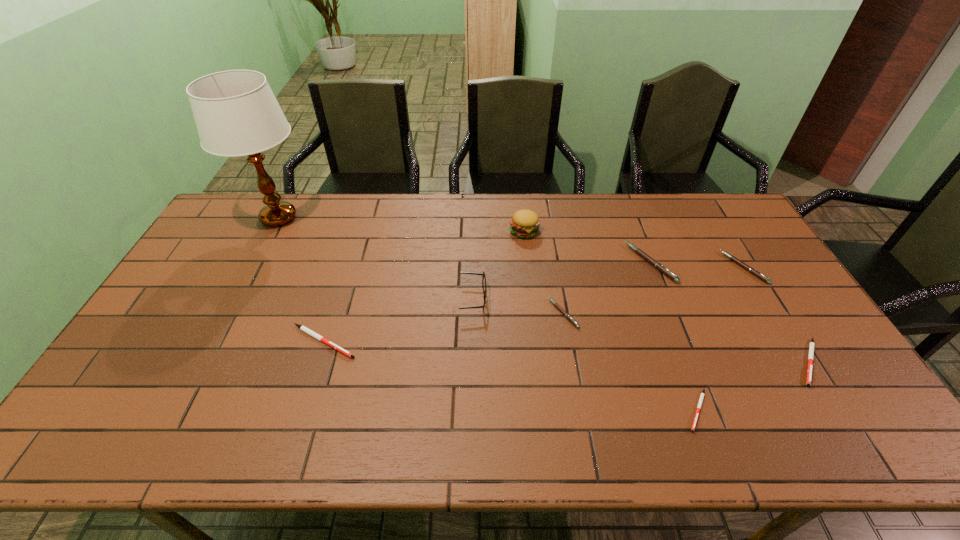
The width and height of the screenshot is (960, 540). Find the location of `object that can be found as the eighth closest to the brown table lamp`. object that can be found as the eighth closest to the brown table lamp is located at coordinates (811, 348).

Select which object is the third closest to the shortest pen. Please provide its 2D coordinates. Your answer should be formatted as a tuple, i.e. [(x, y)], where the tuple contains the x and y coordinates of a point satisfying the conditions above.

[(657, 265)]

Locate an element on the screen. This screenshot has height=540, width=960. pen that is the second nearest to the second biggest pink pen is located at coordinates (811, 348).

This screenshot has width=960, height=540. I want to click on pen that is the closest one to the second biggest pink pen, so click(x=657, y=265).

Point out which pink pen is positioned as the second nearest to the nearest pen. Please provide its 2D coordinates. Your answer should be formatted as a tuple, i.e. [(x, y)], where the tuple contains the x and y coordinates of a point satisfying the conditions above.

[(657, 265)]

Image resolution: width=960 pixels, height=540 pixels. I want to click on pink pen that is the closest one to the leftmost pen, so click(x=556, y=305).

Identify the location of the closest white pen to the spectacles. This screenshot has height=540, width=960. (303, 328).

This screenshot has height=540, width=960. Find the location of `white pen that is the second closest to the brown table lamp`. white pen that is the second closest to the brown table lamp is located at coordinates (702, 394).